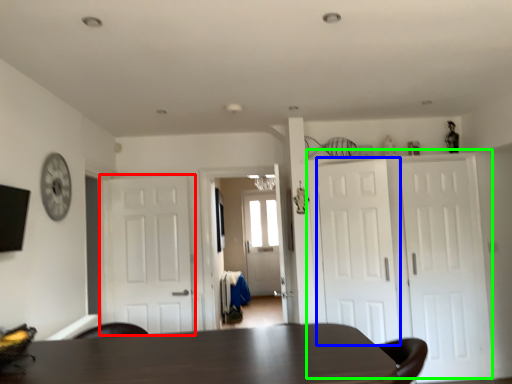
Question: Based on their relative distances, which object is nearer to door (highlighted by a red box)? Choose from door (highlighted by a blue box) and door (highlighted by a green box).

Choices:
 (A) door
 (B) door

Answer: (A)